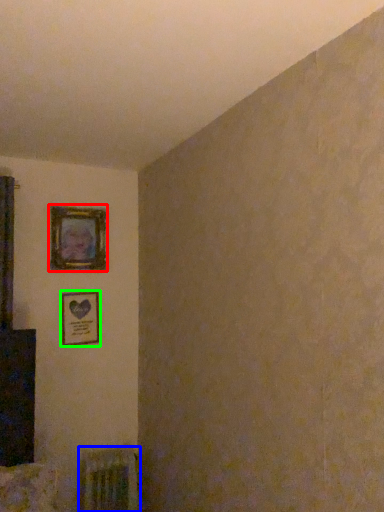
Question: Based on their relative distances, which object is nearer to picture frame (highlighted by a red box)? Choose from radiator (highlighted by a blue box) and picture frame (highlighted by a green box).

Choices:
 (A) radiator
 (B) picture frame

Answer: (B)